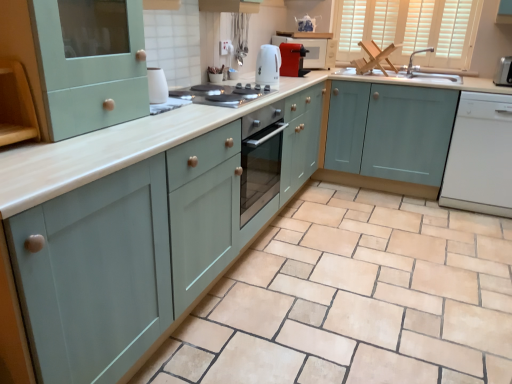
You are a GUI agent. You are given a task and a screenshot of the screen. Output one action in this format:
    pyautogui.click(x=<x>, y=<y>)
    Task: Click on the wooden shelf at left, placed as the 4th cabinetry when sorted from right to left
    The height and width of the screenshot is (384, 512).
    Given the screenshot: What is the action you would take?
    pyautogui.click(x=16, y=105)

Image resolution: width=512 pixels, height=384 pixels. I want to click on light blue wood cabinet at center, which is counted as the first cabinetry, starting from the right, so click(x=389, y=136).

The width and height of the screenshot is (512, 384). What do you see at coordinates (389, 136) in the screenshot?
I see `light blue wood cabinet at center, the fourth cabinetry from the left` at bounding box center [389, 136].

You are a GUI agent. You are given a task and a screenshot of the screen. Output one action in this format:
    pyautogui.click(x=<x>, y=<y>)
    Task: Click on the mint green wood cabinet at upper left, the second cabinetry positioned from the left
    This screenshot has height=384, width=512.
    Given the screenshot: What is the action you would take?
    pyautogui.click(x=80, y=61)

Image resolution: width=512 pixels, height=384 pixels. I want to click on microwave that is above the light blue wood cabinet at center, which is counted as the first cabinetry, starting from the right (from a real-world perspective), so click(313, 49).

Does point (440, 148) come in front of point (293, 34)?

Yes, point (440, 148) is closer to viewer.

From a real-world perspective, who is located lower, light blue wood cabinet at center, which is counted as the first cabinetry, starting from the right, or matte red microwave at upper center?

light blue wood cabinet at center, which is counted as the first cabinetry, starting from the right.

Which object is positioned more to the left, light blue wood cabinet at center, the fourth cabinetry from the left, or matte red microwave at upper center?

matte red microwave at upper center.

From the image's perspective, which appliance is the 2nd one above the white glossy electric kettle at center, arranged as the 2th appliance when viewed from the front? Please provide its 2D coordinates.

[(292, 60)]

Choose the correct answer: Is white glossy electric kettle at center, placed as the third appliance when sorted from right to left, inside matte red toaster at upper center, which ranks as the third appliance in left-to-right order, or outside it?

white glossy electric kettle at center, placed as the third appliance when sorted from right to left, lies outside matte red toaster at upper center, which ranks as the third appliance in left-to-right order.

Based on the photo, considering their positions, is white glossy electric kettle at center, arranged as the 2th appliance when viewed from the front, located in front of or behind matte red toaster at upper center, arranged as the 2th appliance when viewed from the right?

white glossy electric kettle at center, arranged as the 2th appliance when viewed from the front, is in front of matte red toaster at upper center, arranged as the 2th appliance when viewed from the right.

From a real-world perspective, is white glossy electric kettle at center, which is counted as the 2th appliance, starting from the left, over matte red toaster at upper center, which appears as the 4th appliance when viewed from the front?

Yes, from a real-world perspective, white glossy electric kettle at center, which is counted as the 2th appliance, starting from the left, is on top of matte red toaster at upper center, which appears as the 4th appliance when viewed from the front.

In order to click on ceramic tile lying on the left of satin silver toaster at upper right, marked as the first appliance in a right-to-left arrangement in this screenshot , I will do `click(355, 299)`.

Can you confirm if matte ceramic tile at center is taller than satin silver toaster at upper right, marked as the 2th appliance in a back-to-front arrangement?

No.

Between matte ceramic tile at center and satin silver toaster at upper right, placed as the 4th appliance when sorted from left to right, which one has larger width?

matte ceramic tile at center.

Identify the location of ceramic tile in front of the white wood window at upper right. This screenshot has height=384, width=512. (355, 299).

Looking at this image, between matte ceramic tile at center and white wood window at upper right, which one appears on the left side from the viewer's perspective?

Positioned to the left is matte ceramic tile at center.

Is matte ceramic tile at center in front of or behind white wood window at upper right in the image?

matte ceramic tile at center is in front of white wood window at upper right.

How many degrees apart are the facing directions of matte ceramic tile at center and white wood window at upper right?

The angle between the facing direction of matte ceramic tile at center and the facing direction of white wood window at upper right is 0.262 degrees.

Is matte ceramic tile at center looking in the opposite direction of matte red toaster at upper center, the 1th appliance in the back-to-front sequence?

No, matte ceramic tile at center is not facing the opposite direction of matte red toaster at upper center, the 1th appliance in the back-to-front sequence.

From the image's perspective, is matte ceramic tile at center above or below matte red toaster at upper center, which appears as the 4th appliance when viewed from the front?

Clearly, from the image's perspective, matte ceramic tile at center is below matte red toaster at upper center, which appears as the 4th appliance when viewed from the front.

Between point (230, 326) and point (304, 56), which one is positioned in front?

The point (230, 326) is in front.

Would you consider matte teal cabinet at center, placed as the third cabinetry when sorted from left to right, to be distant from white glossy dishwasher at right?

Absolutely, matte teal cabinet at center, placed as the third cabinetry when sorted from left to right, is distant from white glossy dishwasher at right.

From the image's perspective, which is above, matte teal cabinet at center, the second cabinetry positioned from the right, or white glossy dishwasher at right?

white glossy dishwasher at right appears higher in the image.

In the scene shown: Considering the sizes of matte teal cabinet at center, the second cabinetry positioned from the right, and white glossy dishwasher at right in the image, is matte teal cabinet at center, the second cabinetry positioned from the right, bigger or smaller than white glossy dishwasher at right?

Considering their sizes, matte teal cabinet at center, the second cabinetry positioned from the right, takes up more space than white glossy dishwasher at right.

Considering the relative sizes of matte teal cabinet at center, the second cabinetry positioned from the right, and white glossy dishwasher at right in the image provided, is matte teal cabinet at center, the second cabinetry positioned from the right, shorter than white glossy dishwasher at right?

No.

From the image's perspective, is mint green wood cabinet at upper left, the second cabinetry positioned from the left, located above matte red toaster at upper center, which ranks as the third appliance in left-to-right order?

No.

Is mint green wood cabinet at upper left, the second cabinetry positioned from the left, facing towards matte red toaster at upper center, which appears as the 4th appliance when viewed from the front?

No, mint green wood cabinet at upper left, the second cabinetry positioned from the left, is not facing towards matte red toaster at upper center, which appears as the 4th appliance when viewed from the front.

From a real-world perspective, is mint green wood cabinet at upper left, the second cabinetry positioned from the left, above or below matte red toaster at upper center, the 1th appliance in the back-to-front sequence?

In terms of real-world spatial position, mint green wood cabinet at upper left, the second cabinetry positioned from the left, is above matte red toaster at upper center, the 1th appliance in the back-to-front sequence.

Does point (94, 101) come behind point (296, 54)?

No.

Where is `microwave located above the light blue wood cabinet at center, the fourth cabinetry from the left (from a real-world perspective)`? microwave located above the light blue wood cabinet at center, the fourth cabinetry from the left (from a real-world perspective) is located at coordinates (313, 49).

Find the location of a particular element. the 2nd appliance positioned above the white glossy electric kettle at center, arranged as the 2th appliance when viewed from the front (from the image's perspective) is located at coordinates (292, 60).

Based on their spatial positions, is white wood window at upper right or matte silver faucet at upper right further from light blue wood cabinet at center, which is counted as the first cabinetry, starting from the right?

white wood window at upper right is further to light blue wood cabinet at center, which is counted as the first cabinetry, starting from the right.

From the image, which object appears to be farther from mint green wood cabinet at upper left, the third cabinetry positioned from the right, matte red microwave at upper center or light blue wood cabinet at center, which is counted as the first cabinetry, starting from the right?

Among the two, light blue wood cabinet at center, which is counted as the first cabinetry, starting from the right, is located further to mint green wood cabinet at upper left, the third cabinetry positioned from the right.

Looking at the image, which one is located further to white glossy electric stove at center, matte ceramic tile at center or matte teal cabinet at center, the second cabinetry positioned from the right?

matte ceramic tile at center is further to white glossy electric stove at center.

Looking at the image, which one is located closer to white glossy dishwasher at right, white wood window at upper right or matte silver faucet at upper right?

The object closer to white glossy dishwasher at right is white wood window at upper right.

Estimate the real-world distances between objects in this image. Which object is closer to matte red toaster at upper center, arranged as the 2th appliance when viewed from the right, mint green wood cabinet at upper left, the third cabinetry positioned from the right, or light blue wood cabinet at center, which is counted as the first cabinetry, starting from the right?

light blue wood cabinet at center, which is counted as the first cabinetry, starting from the right.

Considering their positions, is light blue wood cabinet at center, which is counted as the first cabinetry, starting from the right, positioned closer to white glossy dishwasher at right than matte teal cabinet at center, the second cabinetry positioned from the right?

light blue wood cabinet at center, which is counted as the first cabinetry, starting from the right, is closer to white glossy dishwasher at right.

Estimate the real-world distances between objects in this image. Which object is further from satin silver toaster at upper right, placed as the 4th appliance when sorted from left to right, light blue wood cabinet at center, the fourth cabinetry from the left, or white glossy paper towel holder at upper center, the first appliance viewed from the front?

The object further to satin silver toaster at upper right, placed as the 4th appliance when sorted from left to right, is white glossy paper towel holder at upper center, the first appliance viewed from the front.

From the image, which object appears to be farther from light blue wood cabinet at center, the fourth cabinetry from the left, mint green wood cabinet at upper left, the third cabinetry positioned from the right, or white glossy paper towel holder at upper center, the first appliance viewed from the front?

Based on the image, mint green wood cabinet at upper left, the third cabinetry positioned from the right, appears to be further to light blue wood cabinet at center, the fourth cabinetry from the left.

This screenshot has width=512, height=384. Find the location of `microwave between white glossy electric kettle at center, which is counted as the 2th appliance, starting from the left, and white wood window at upper right from left to right`. microwave between white glossy electric kettle at center, which is counted as the 2th appliance, starting from the left, and white wood window at upper right from left to right is located at coordinates (313, 49).

Image resolution: width=512 pixels, height=384 pixels. I want to click on microwave between matte red toaster at upper center, arranged as the 2th appliance when viewed from the right, and light blue wood cabinet at center, the fourth cabinetry from the left, in the horizontal direction, so click(x=313, y=49).

Locate an element on the screen. The height and width of the screenshot is (384, 512). microwave between white glossy paper towel holder at upper center, which is counted as the fourth appliance, starting from the right, and white glossy dishwasher at right from left to right is located at coordinates (313, 49).

I want to click on ceramic tile located between mint green wood cabinet at upper left, the third cabinetry positioned from the right, and satin silver toaster at upper right, the 3th appliance positioned from the front, in the left-right direction, so click(x=355, y=299).